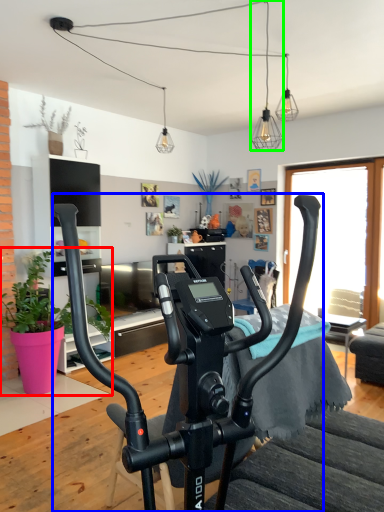
Question: Which object is the closest to the houseplant (highlighted by a red box)? Choose among these: stationary bicycle (highlighted by a blue box) or light fixture (highlighted by a green box).

Choices:
 (A) stationary bicycle
 (B) light fixture

Answer: (A)